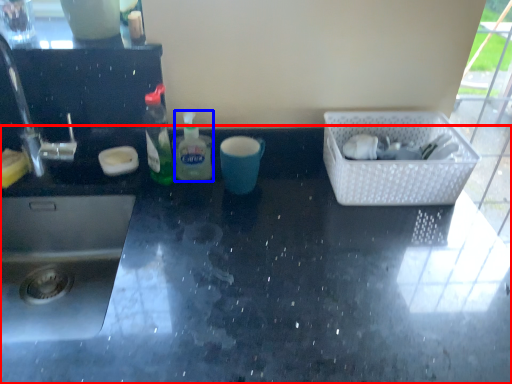
Question: Which point is closer to the camera, countertop (highlighted by a red box) or bottle (highlighted by a blue box)?

Choices:
 (A) countertop
 (B) bottle

Answer: (A)